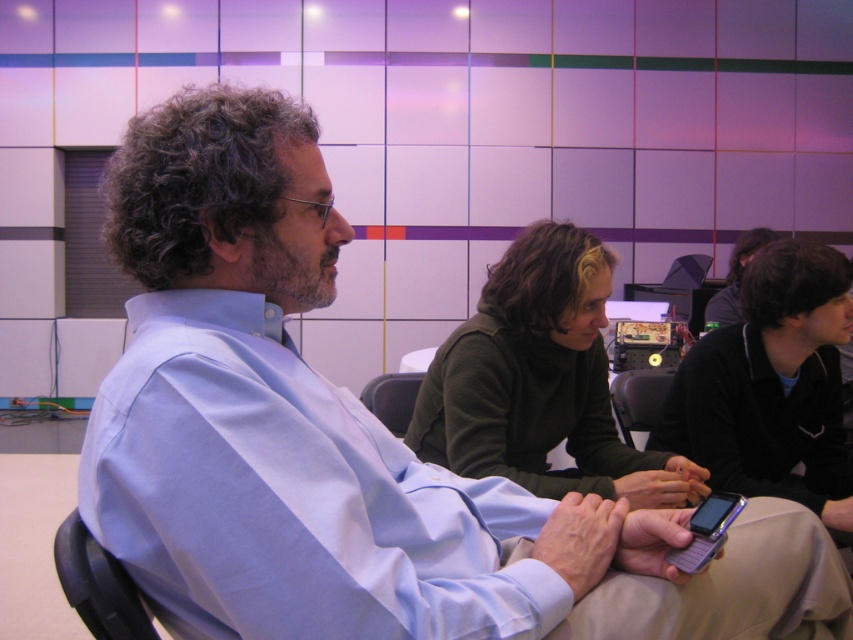
You are sitting in the room and want to move from the gray plastic chair at center to the black plastic chair at center. Which direction should you move in?

The black plastic chair at center is to the right of the gray plastic chair at center, so you should move to the right.

You are a person sitting in the gray plastic chair at center. You want to place your black matte phone at center on the floor in front of you. Is the phone taller than the chair?

The black matte phone at center is much taller than the gray plastic chair at center, so yes, the phone is taller than the chair.